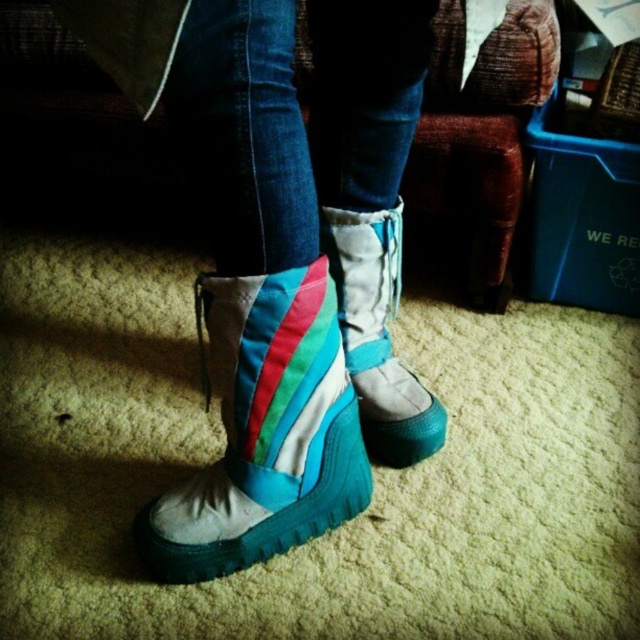
You are a photographer setting up a shoot and want to ensure the teal fabric boot at lower center and the teal suede boot at center are both visible in the frame. Based on their positions, which boot is closer to the camera?

The teal fabric boot at lower center is closer to the camera because it is in front of the teal suede boot at center.

You are a fashion designer examining a pair of teal fabric boots at center and a teal suede boot at center. Which one is placed on top of the other?

The teal fabric boots at center is positioned over the teal suede boot at center, so it is placed on top.